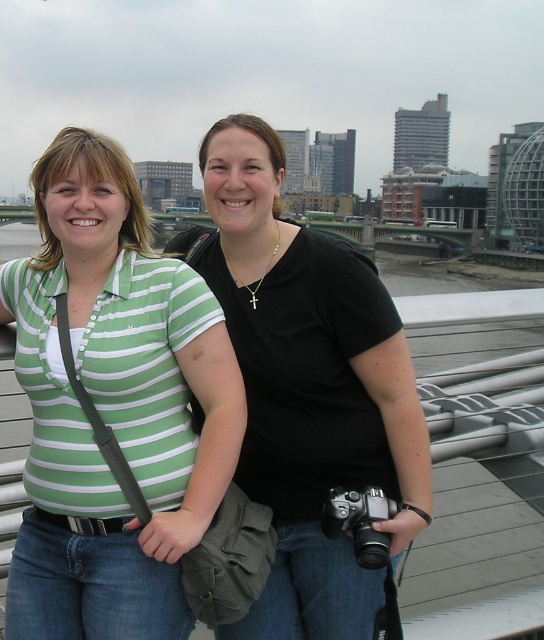
You are a photographer trying to capture a photo of the green striped shirt at left without including the person on the right. Based on their positions, can you position yourself to the left or right side of the scene to exclude the person on the right?

The green striped shirt at left is located at point (113,406), so positioning yourself to the right side of the scene would allow you to capture the green striped shirt at left while excluding the person on the right.

You are a photographer trying to capture a candid shot of the two people in the scene. You want to ensure the black matte shirt at center and the silver metallic camera at lower center are both visible in the frame. Based on their positions, which object should be placed closer to the left side of your camera viewfinder?

The black matte shirt at center is positioned on the left side of the silver metallic camera at lower center, so to have both visible, the black matte shirt at center should be placed closer to the left side of your camera viewfinder.

You are standing on a bridge overlooking a city and see a person wearing a black matte shirt at center. Where would you look to find this person in the image?

The black matte shirt at center is located at the 2D coordinates point (308, 388) in the image.